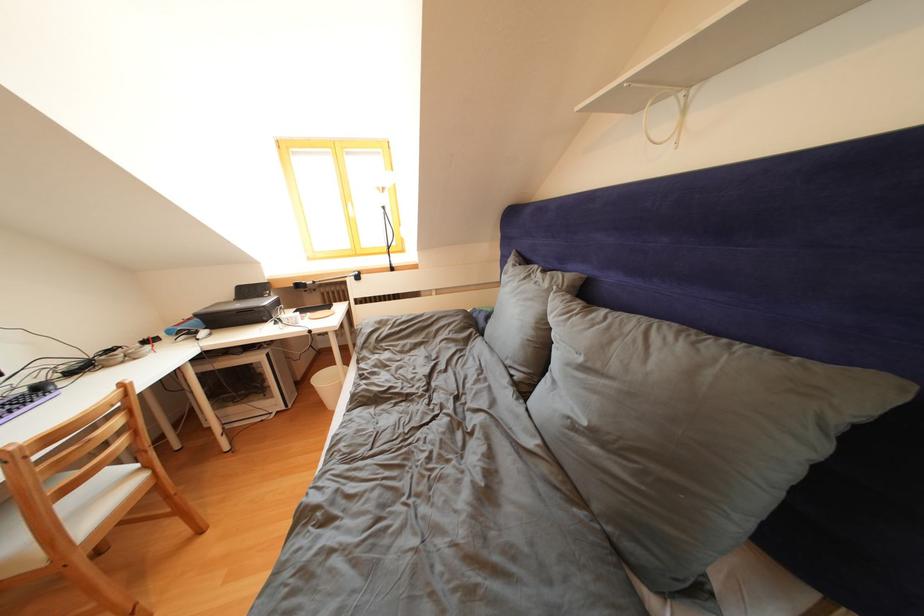
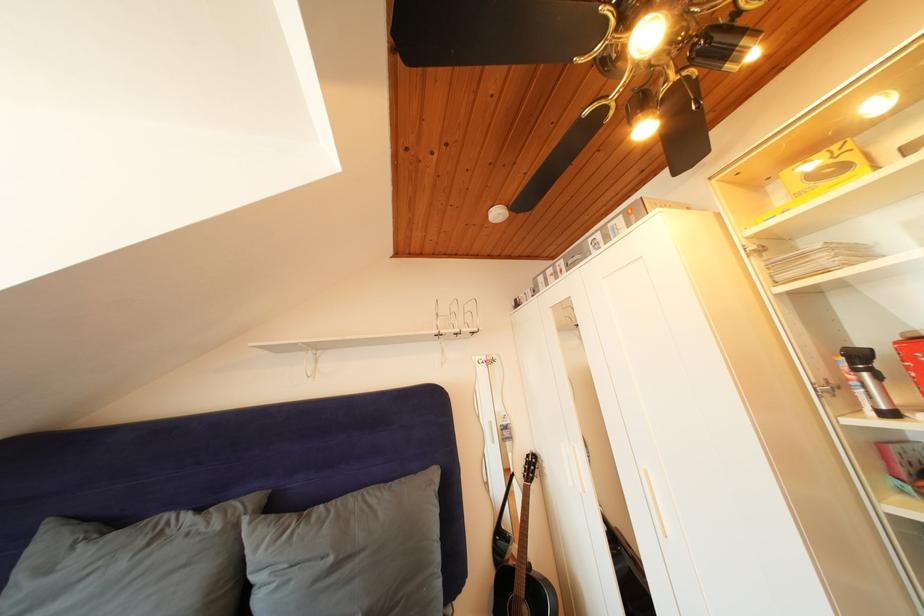
How did the camera likely rotate?

The camera's rotation is toward right-up.